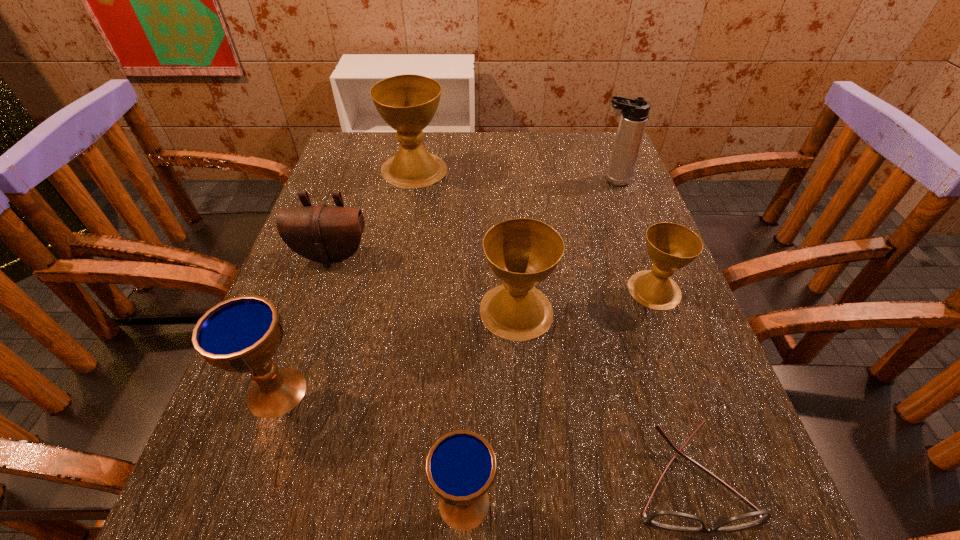
Where is `vacant space in between the left blue chalice and the shortest object`? The height and width of the screenshot is (540, 960). vacant space in between the left blue chalice and the shortest object is located at coordinates pyautogui.click(x=483, y=436).

Locate an element on the screen. This screenshot has height=540, width=960. blank region between the shortest object and the brown pouch is located at coordinates (511, 368).

Identify the location of blank region between the leftmost brown chalice and the nearest chalice. (439, 336).

Locate an element on the screen. This screenshot has height=540, width=960. free space between the rightmost chalice and the pouch is located at coordinates click(492, 273).

The height and width of the screenshot is (540, 960). Identify the location of empty location between the rightmost chalice and the farther blue chalice. (466, 341).

This screenshot has height=540, width=960. I want to click on free spot between the smaller blue chalice and the left blue chalice, so click(x=371, y=447).

What are the coordinates of `vacant area that lies between the thermos bottle and the brown pouch` in the screenshot? It's located at (472, 218).

At what (x,y) coordinates should I click in order to perform the action: click on free space between the nearer blue chalice and the smallest brown chalice. Please return your answer as a coordinate pair (x, y). This screenshot has width=960, height=540. Looking at the image, I should click on (559, 396).

The height and width of the screenshot is (540, 960). I want to click on free space between the leftmost chalice and the shortest object, so click(483, 436).

Choose which object is the fourth nearest neighbor to the fourth farthest chalice. Please provide its 2D coordinates. Your answer should be formatted as a tuple, i.e. [(x, y)], where the tuple contains the x and y coordinates of a point satisfying the conditions above.

[(672, 520)]